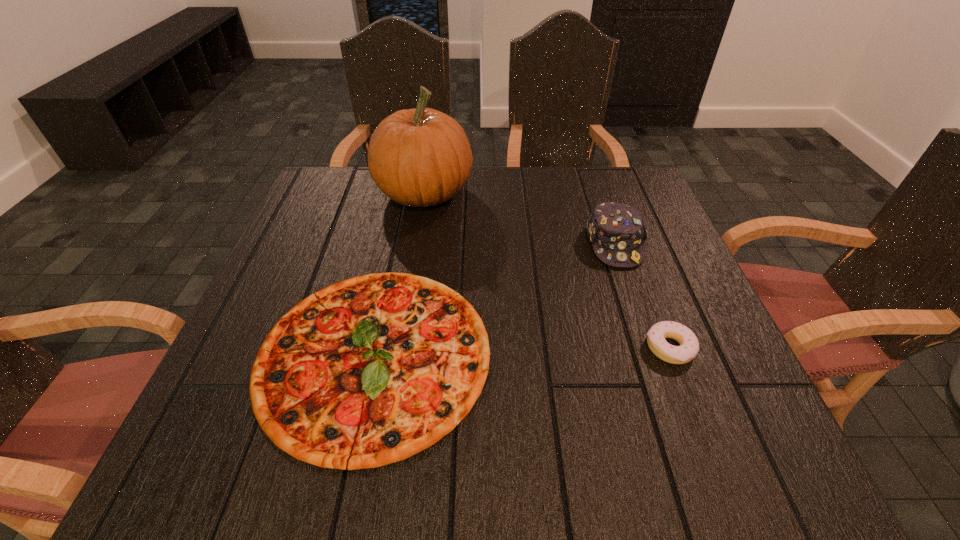
You are a GUI agent. You are given a task and a screenshot of the screen. Output one action in this format:
    pyautogui.click(x=<x>, y=<y>)
    Task: Click on the object that is positioned at the left edge
    Image resolution: width=960 pixels, height=540 pixels.
    Given the screenshot: What is the action you would take?
    pyautogui.click(x=371, y=370)

Locate an element on the screen. headwear that is at the right edge is located at coordinates click(617, 231).

I want to click on doughnut positioned at the right edge, so (x=689, y=346).

I want to click on object situated at the near left corner, so click(x=371, y=370).

In the image, there is a desktop. At what (x,y) coordinates should I click in order to perform the action: click on free region at the far edge. Please return your answer as a coordinate pair (x, y). The height and width of the screenshot is (540, 960). Looking at the image, I should click on (568, 198).

The image size is (960, 540). I want to click on vacant space at the near edge, so click(468, 430).

Locate an element on the screen. The height and width of the screenshot is (540, 960). free space at the left edge of the desktop is located at coordinates (345, 262).

Locate an element on the screen. The width and height of the screenshot is (960, 540). blank space at the right edge of the desktop is located at coordinates (661, 370).

The height and width of the screenshot is (540, 960). Identify the location of free space at the far left corner of the desktop. (349, 170).

In the image, there is a desktop. At what (x,y) coordinates should I click in order to perform the action: click on vacant space at the far right corner. Please return your answer as a coordinate pair (x, y). This screenshot has width=960, height=540. Looking at the image, I should click on (649, 197).